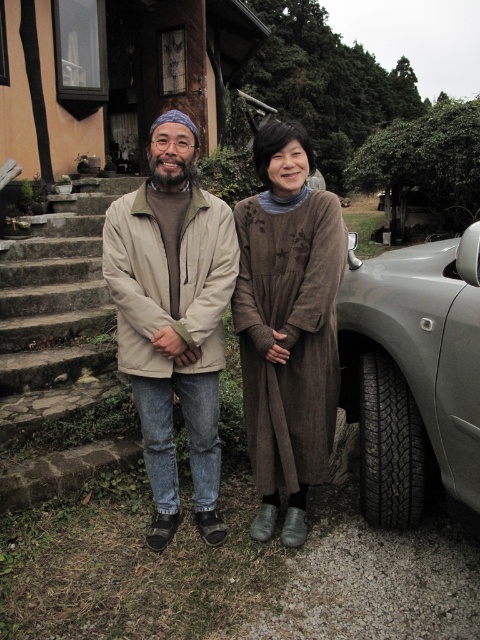
Is the position of brown textured dress at lower right less distant than that of stone steps at left?

Yes, brown textured dress at lower right is closer to the viewer.

From the picture: Who is lower down, brown textured dress at lower right or stone steps at left?

Positioned lower is stone steps at left.

Does point (297, 156) come farther from viewer compared to point (25, 397)?

No.

I want to click on brown textured dress at lower right, so click(x=288, y=324).

Is beige fabric jacket at center taller than stone steps at left?

Indeed, beige fabric jacket at center has a greater height compared to stone steps at left.

Between point (118, 220) and point (98, 292), which one is positioned behind?

The point (98, 292) is more distant.

In order to click on beige fabric jacket at center in this screenshot , I will do `click(172, 316)`.

Is the position of brown textured dress at lower right more distant than that of black rubber tire at lower right?

No, it is in front of black rubber tire at lower right.

Does brown textured dress at lower right have a lesser width compared to black rubber tire at lower right?

Incorrect, brown textured dress at lower right's width is not less than black rubber tire at lower right's.

Identify the location of brown textured dress at lower right. The height and width of the screenshot is (640, 480). (288, 324).